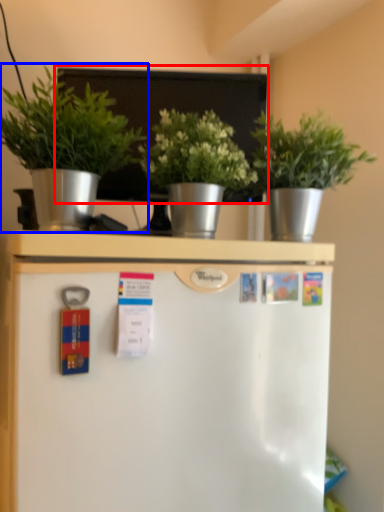
Question: Which of the following is the farthest to the observer, bulletin board (highlighted by a red box) or houseplant (highlighted by a blue box)?

Choices:
 (A) bulletin board
 (B) houseplant

Answer: (A)